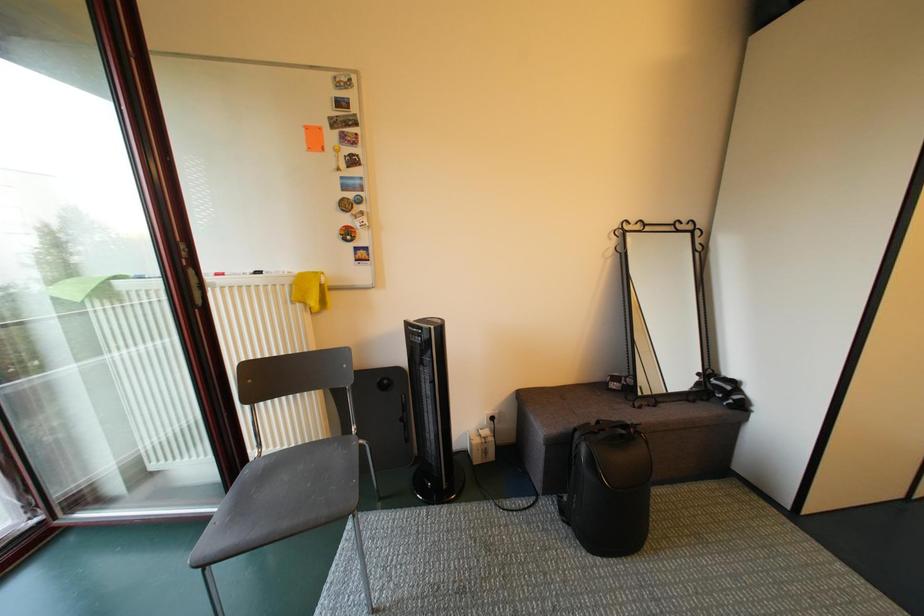
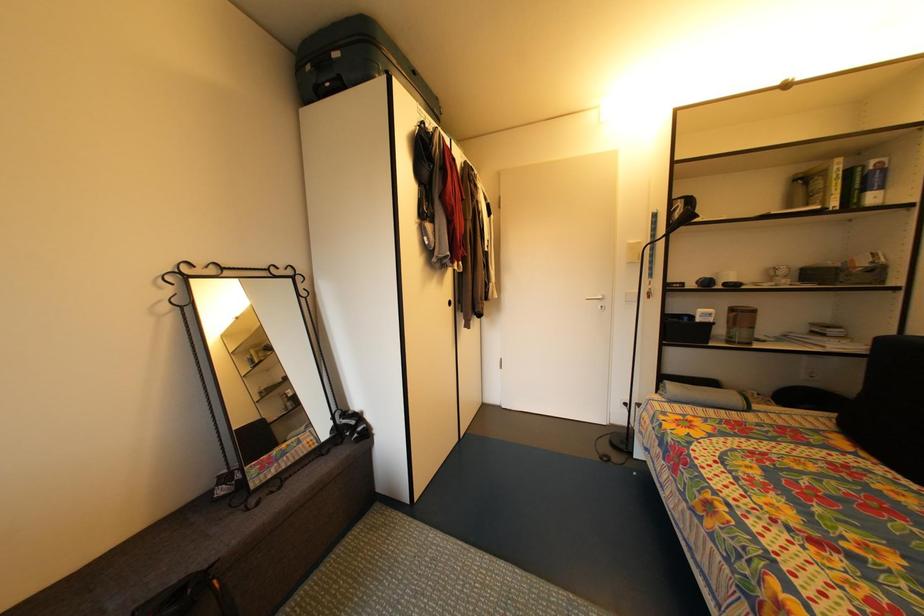
Question: The first image is from the beginning of the video and the second image is from the end. How did the camera likely rotate when shooting the video?

Choices:
 (A) Left
 (B) Right
 (C) Up
 (D) Down

Answer: (B)